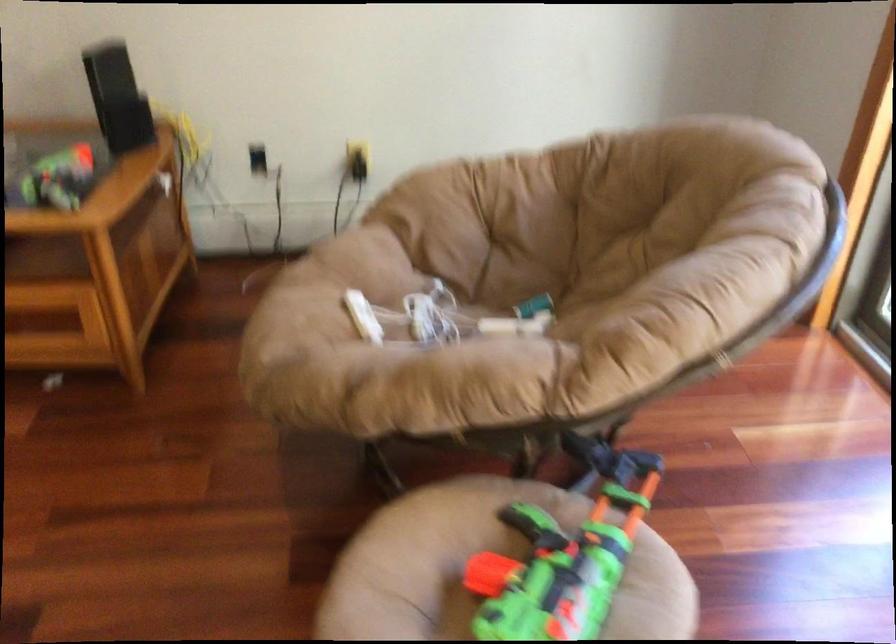
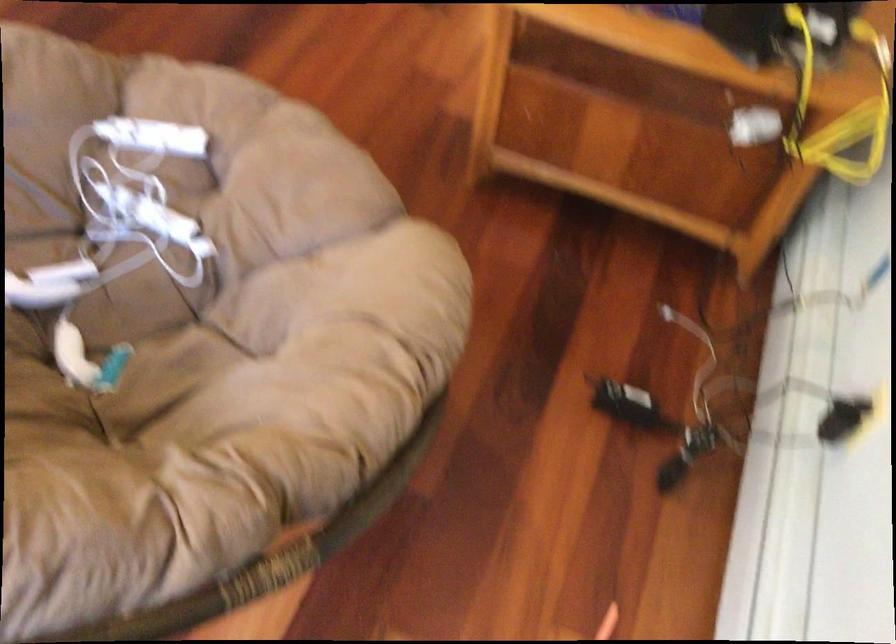
Find the pixel in the second image that matches pixel 448 327 in the first image.

(113, 236)